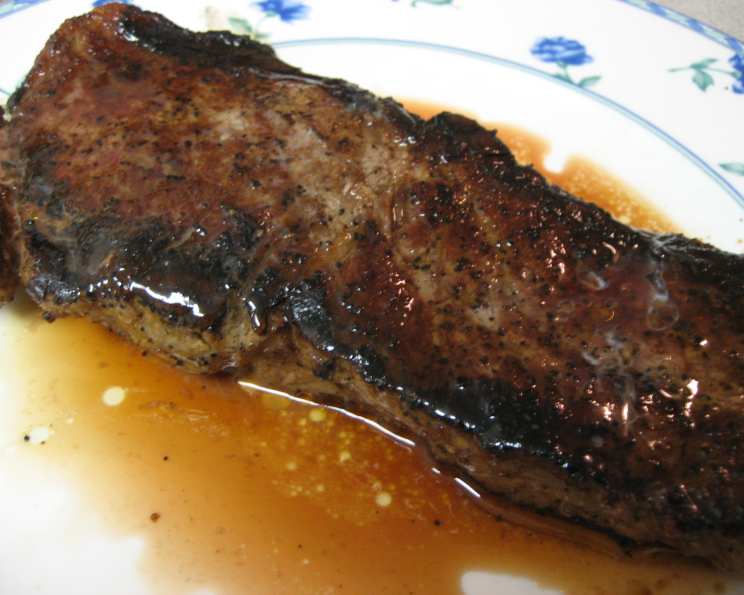
Where is `cooked food`? The height and width of the screenshot is (595, 744). cooked food is located at coordinates (414, 258).